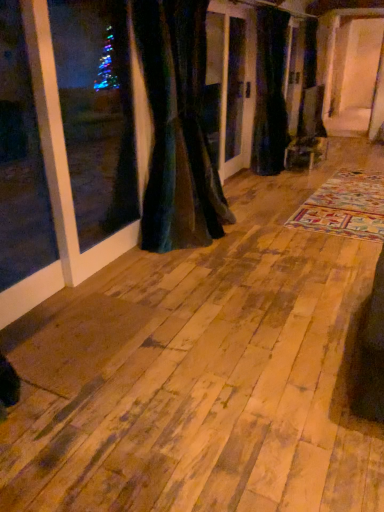
You are a GUI agent. You are given a task and a screenshot of the screen. Output one action in this format:
    pyautogui.click(x=<x>, y=<y>)
    Task: Click on the vacant area that is in front of velvet dark green curtain at center, arranged as the 2th curtain when viewed from the back
    
    Given the screenshot: What is the action you would take?
    pyautogui.click(x=187, y=274)